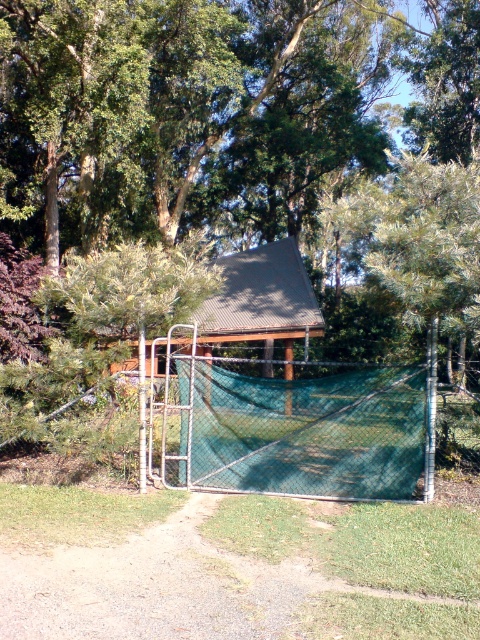
Which of these two, green leafy tree at center or green corrugated metal hut at center, stands taller?

Standing taller between the two is green leafy tree at center.

Who is lower down, green leafy tree at center or green corrugated metal hut at center?

Positioned lower is green corrugated metal hut at center.

Does point (97, 83) come in front of point (288, 264)?

Yes, it is.

Where is `green leafy tree at center`? The height and width of the screenshot is (640, 480). green leafy tree at center is located at coordinates click(228, 124).

Is point (444, 92) behind point (243, 445)?

Yes, point (444, 92) is behind point (243, 445).

Is point (104, 122) more distant than point (335, 372)?

Yes, point (104, 122) is farther from viewer.

Locate an element on the screen. This screenshot has width=480, height=640. green leafy tree at center is located at coordinates (228, 124).

Is point (252, 417) farther from viewer compared to point (238, 269)?

No, it is in front of (238, 269).

Which is below, green mesh tennis net at center or green corrugated metal hut at center?

green mesh tennis net at center is lower down.

I want to click on green mesh tennis net at center, so click(302, 432).